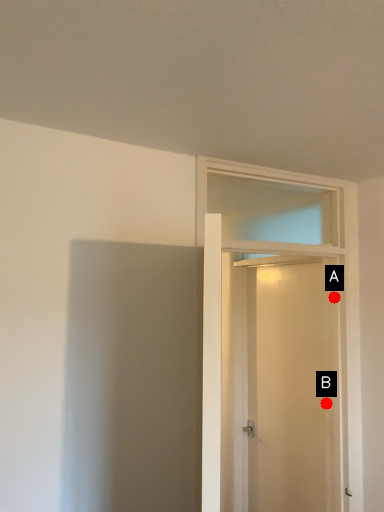
Question: Two points are circled on the image, labeled by A and B beside each circle. Among these points, which one is farthest from the camera?

Choices:
 (A) A is further
 (B) B is further

Answer: (B)